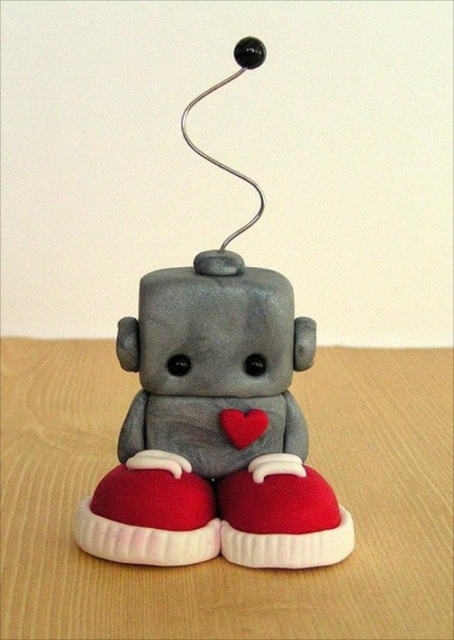
Question: Based on their relative distances, which object is nearer to the matte gray robot at center?

Choices:
 (A) wooden table at center
 (B) red matte heart at center
 (C) matte red shoe at lower center
 (D) red matte shoe at lower center

Answer: (D)

Question: Is wooden table at center above red matte shoe at lower center?

Choices:
 (A) yes
 (B) no

Answer: (A)

Question: Does red matte shoe at lower center have a smaller size compared to red matte heart at center?

Choices:
 (A) yes
 (B) no

Answer: (B)

Question: Which object is closer to the camera taking this photo?

Choices:
 (A) matte gray robot at center
 (B) matte red shoe at lower center

Answer: (B)

Question: Is matte gray robot at center positioned at the back of red matte heart at center?

Choices:
 (A) no
 (B) yes

Answer: (A)

Question: Which point appears farthest from the camera in this image?

Choices:
 (A) (276, 520)
 (B) (206, 516)
 (C) (188, 492)

Answer: (B)